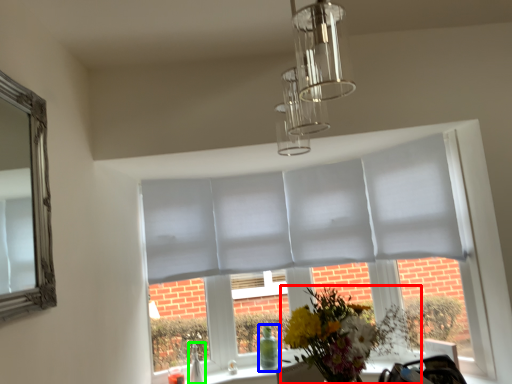
Question: Based on their relative distances, which object is nearer to flower (highlighted by a red box)? Choose from glass vase (highlighted by a blue box) and glass vase (highlighted by a green box).

Choices:
 (A) glass vase
 (B) glass vase

Answer: (A)